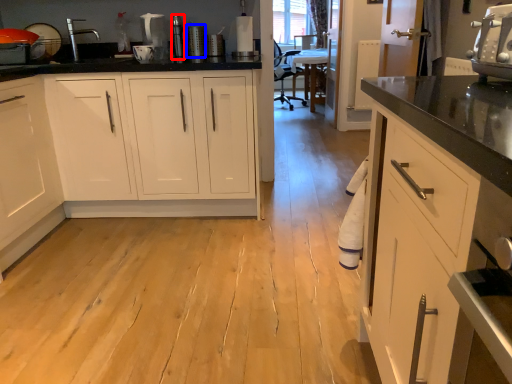
Question: Which object appears closest to the camera in this image, appliance (highlighted by a red box) or appliance (highlighted by a blue box)?

Choices:
 (A) appliance
 (B) appliance

Answer: (B)